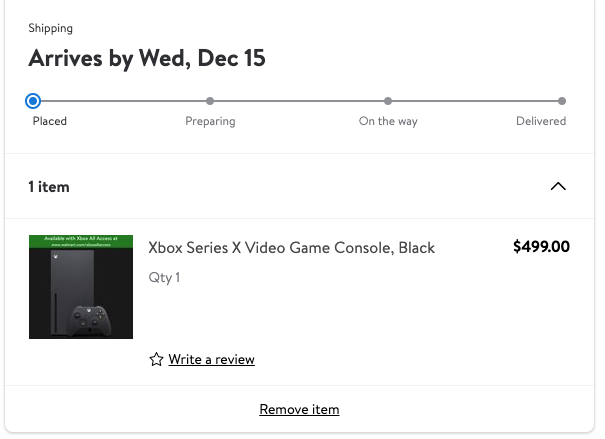
Find the location of a particular element. This screenshot has width=605, height=439. game console is located at coordinates (83, 278).